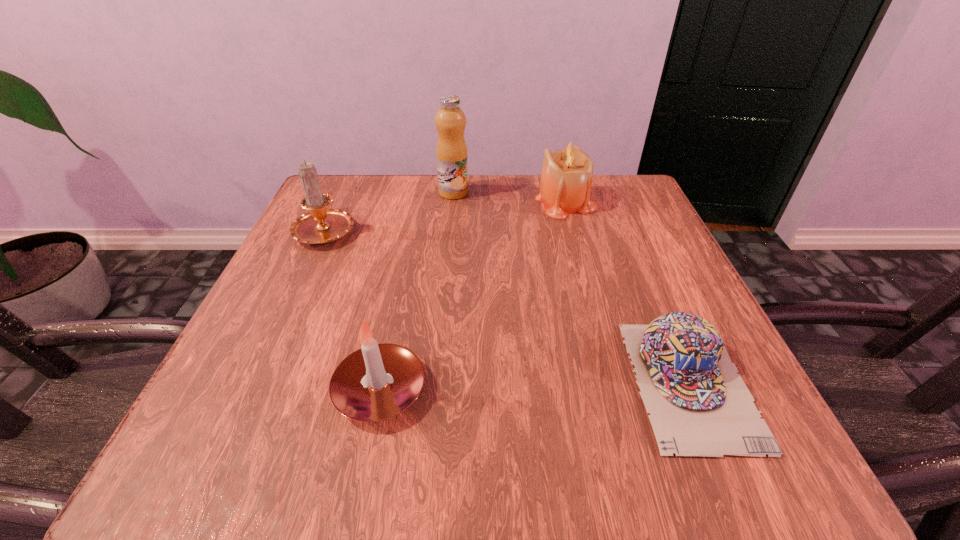
In the image, there is a desktop. Find the location of `free region at the right edge`. free region at the right edge is located at coordinates (644, 286).

You are a GUI agent. You are given a task and a screenshot of the screen. Output one action in this format:
    pyautogui.click(x=<x>, y=<y>)
    Task: Click on the vacant space at the far left corner of the desktop
    
    Given the screenshot: What is the action you would take?
    pyautogui.click(x=376, y=202)

The height and width of the screenshot is (540, 960). What are the coordinates of `free space at the near left corner of the desktop` in the screenshot? It's located at (202, 475).

Where is `vacant space at the far right corner of the desktop`? This screenshot has height=540, width=960. vacant space at the far right corner of the desktop is located at coordinates (632, 226).

Identify the location of vacant region between the shortest object and the leftmost object. This screenshot has width=960, height=540. (508, 306).

The width and height of the screenshot is (960, 540). Identify the location of vacant space in between the leftmost candle and the tallest object. (390, 211).

Find the location of a particular element. empty location between the cap and the nearest candle is located at coordinates (535, 387).

Image resolution: width=960 pixels, height=540 pixels. Identify the location of vacant space in between the leftmost object and the shortest object. (508, 306).

Locate an element on the screen. The height and width of the screenshot is (540, 960). free point between the shortest object and the leftmost object is located at coordinates click(x=508, y=306).

This screenshot has width=960, height=540. I want to click on vacant point located between the fruit juice and the leftmost candle, so click(390, 211).